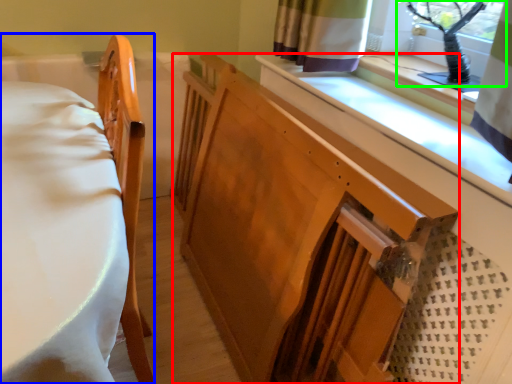
Question: Which is nearer to the changing table (highlighted by a red box)? furniture (highlighted by a blue box) or window screen (highlighted by a green box).

Choices:
 (A) furniture
 (B) window screen

Answer: (A)